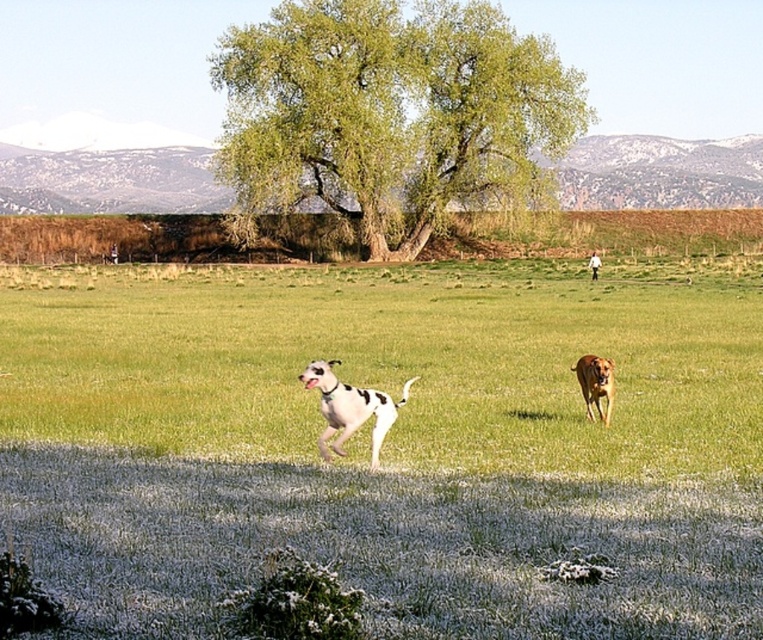
Is the position of green leafy tree at center more distant than that of white-spotted fur dog at center?

Yes, it is.

Measure the distance between green leafy tree at center and white-spotted fur dog at center.

167.10 feet

What do you see at coordinates (390, 113) in the screenshot? Image resolution: width=763 pixels, height=640 pixels. I see `green leafy tree at center` at bounding box center [390, 113].

At what (x,y) coordinates should I click in order to perform the action: click on green leafy tree at center. Please return your answer as a coordinate pair (x, y). This screenshot has height=640, width=763. Looking at the image, I should click on (390, 113).

Consider the image. Which of these two, green grass at center or white-spotted fur dog at center, stands taller?

With more height is green grass at center.

What do you see at coordinates (388, 365) in the screenshot? I see `green grass at center` at bounding box center [388, 365].

This screenshot has width=763, height=640. What are the coordinates of `green grass at center` in the screenshot? It's located at (388, 365).

Does green grass at center have a lesser height compared to green leafy tree at center?

Yes, green grass at center is shorter than green leafy tree at center.

Is point (60, 275) less distant than point (324, 42)?

No, (60, 275) is further to viewer.

Does point (205, 394) lie in front of point (414, 186)?

Yes, point (205, 394) is closer to viewer.

You are a GUI agent. You are given a task and a screenshot of the screen. Output one action in this format:
    pyautogui.click(x=<x>, y=<y>)
    Task: Click on the green grass at center
    
    Given the screenshot: What is the action you would take?
    pyautogui.click(x=388, y=365)